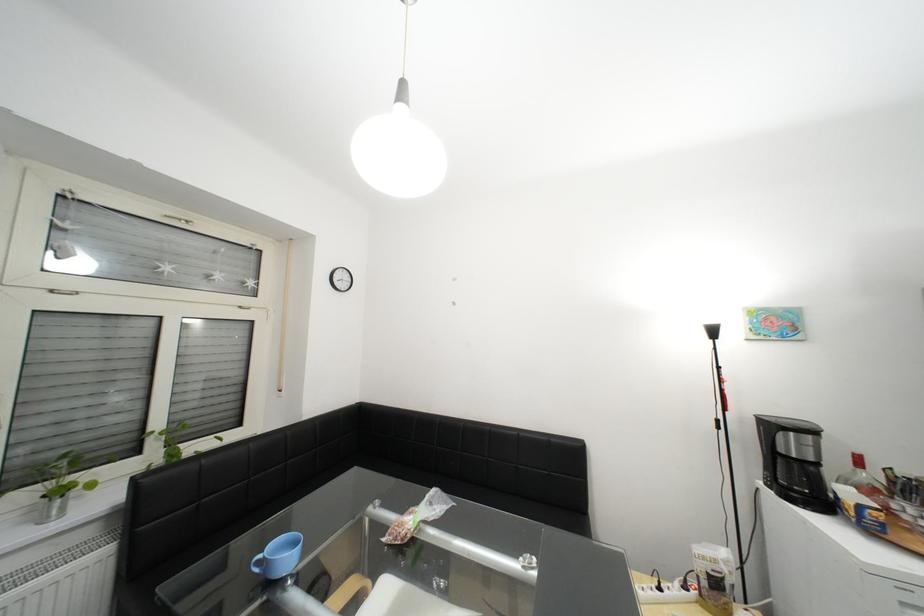
Identify the location of coffee maker lid. Image resolution: width=924 pixels, height=616 pixels. (786, 424).